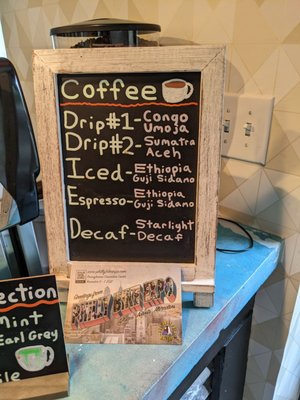
This screenshot has width=300, height=400. Identify the location of white cup. (42, 365).